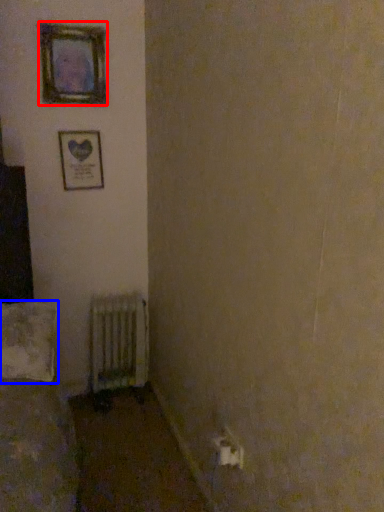
Question: Which object appears closest to the camera in this image, picture frame (highlighted by a red box) or pillow (highlighted by a blue box)?

Choices:
 (A) picture frame
 (B) pillow

Answer: (B)